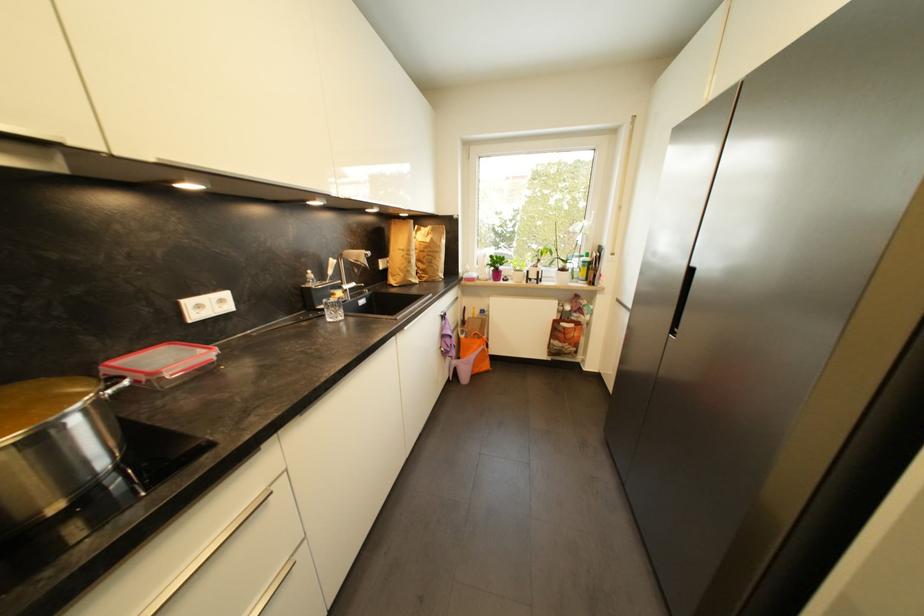
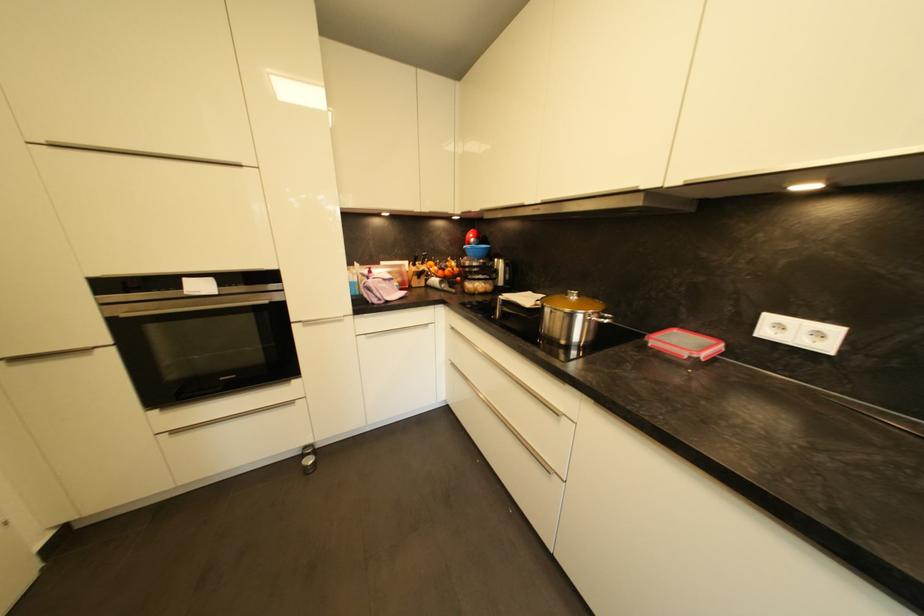
The point at (x=176, y=362) is marked in the first image. Where is the corresponding point in the second image?

(686, 345)